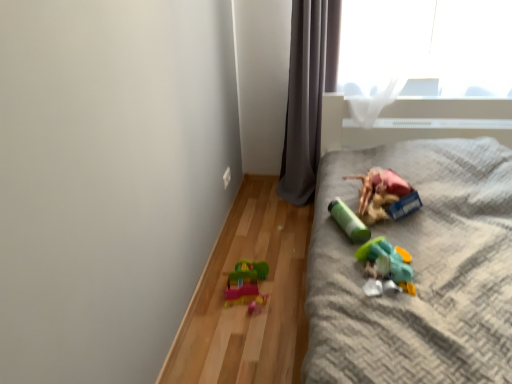
Question: From the image's perspective, does translucent plastic toy at lower left, the 1th toy viewed from the left, appear lower than plastic toy at right?

Choices:
 (A) no
 (B) yes

Answer: (B)

Question: Does translucent plastic toy at lower left, acting as the fourth toy starting from the right, have a greater height compared to plastic toy at right?

Choices:
 (A) yes
 (B) no

Answer: (B)

Question: Is translucent plastic toy at lower left, the 1th toy viewed from the left, closer to camera compared to plastic toy at right?

Choices:
 (A) yes
 (B) no

Answer: (B)

Question: Does translucent plastic toy at lower left, the 1th toy viewed from the left, come behind plastic toy at right?

Choices:
 (A) yes
 (B) no

Answer: (A)

Question: Can you confirm if translucent plastic toy at lower left, the 1th toy viewed from the left, is thinner than plastic toy at right?

Choices:
 (A) yes
 (B) no

Answer: (A)

Question: Considering the relative sizes of translucent plastic toy at lower left, acting as the fourth toy starting from the right, and plastic toy at right in the image provided, is translucent plastic toy at lower left, acting as the fourth toy starting from the right, bigger than plastic toy at right?

Choices:
 (A) yes
 (B) no

Answer: (B)

Question: From a real-world perspective, is matte plastic toy at right, the fourth toy positioned from the left, located beneath green matte cylinder at center, acting as the 2th toy starting from the left?

Choices:
 (A) yes
 (B) no

Answer: (B)

Question: Can you confirm if matte plastic toy at right, placed as the 1th toy when sorted from right to left, is thinner than green matte cylinder at center, acting as the 2th toy starting from the left?

Choices:
 (A) no
 (B) yes

Answer: (A)

Question: Are matte plastic toy at right, the fourth toy positioned from the left, and green matte cylinder at center, acting as the 2th toy starting from the left, far apart?

Choices:
 (A) yes
 (B) no

Answer: (B)

Question: Can you confirm if matte plastic toy at right, placed as the 1th toy when sorted from right to left, is bigger than green matte cylinder at center, acting as the 2th toy starting from the left?

Choices:
 (A) yes
 (B) no

Answer: (A)

Question: Is matte plastic toy at right, placed as the 1th toy when sorted from right to left, oriented away from green matte cylinder at center, acting as the 2th toy starting from the left?

Choices:
 (A) yes
 (B) no

Answer: (B)

Question: Does matte plastic toy at right, placed as the 1th toy when sorted from right to left, have a greater height compared to green matte cylinder at center, the 3th toy when ordered from right to left?

Choices:
 (A) no
 (B) yes

Answer: (B)

Question: From a real-world perspective, does plastic toy at right stand above translucent plastic toy at lower right, acting as the 3th toy starting from the left?

Choices:
 (A) no
 (B) yes

Answer: (A)